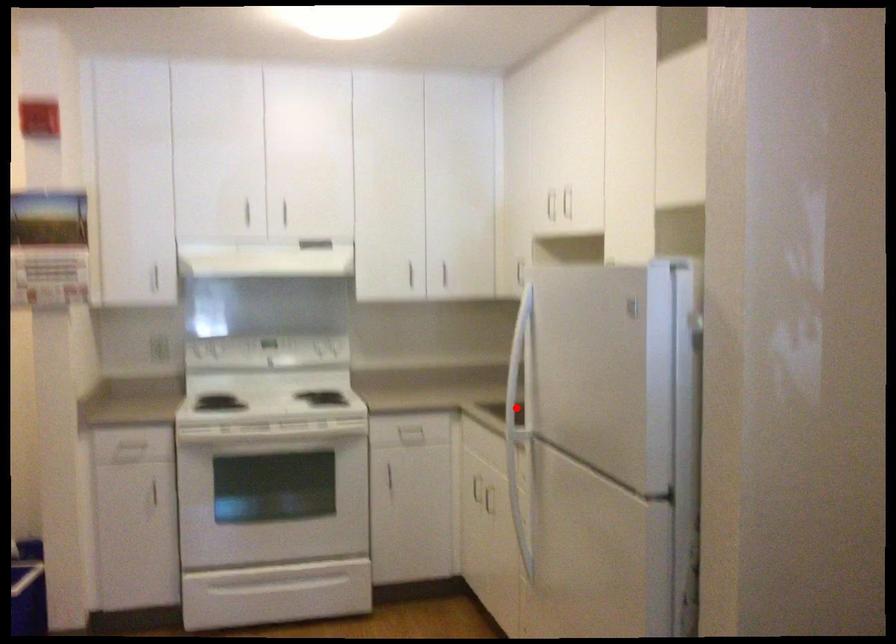
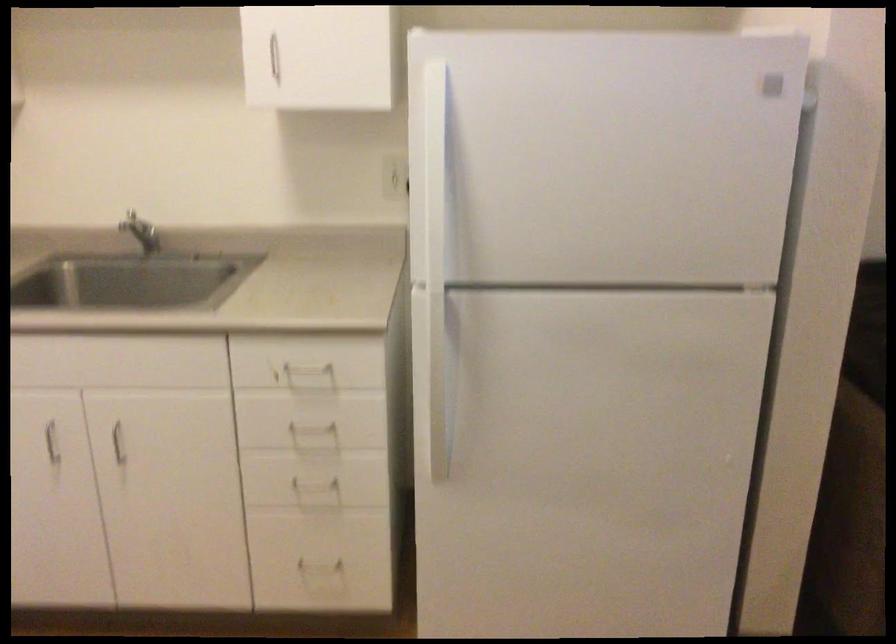
Question: I am providing you with two images of the same scene from different viewpoints. A red point is marked on the first image. Can you still see the location of the red point in image 2?

Choices:
 (A) Yes
 (B) No

Answer: (A)